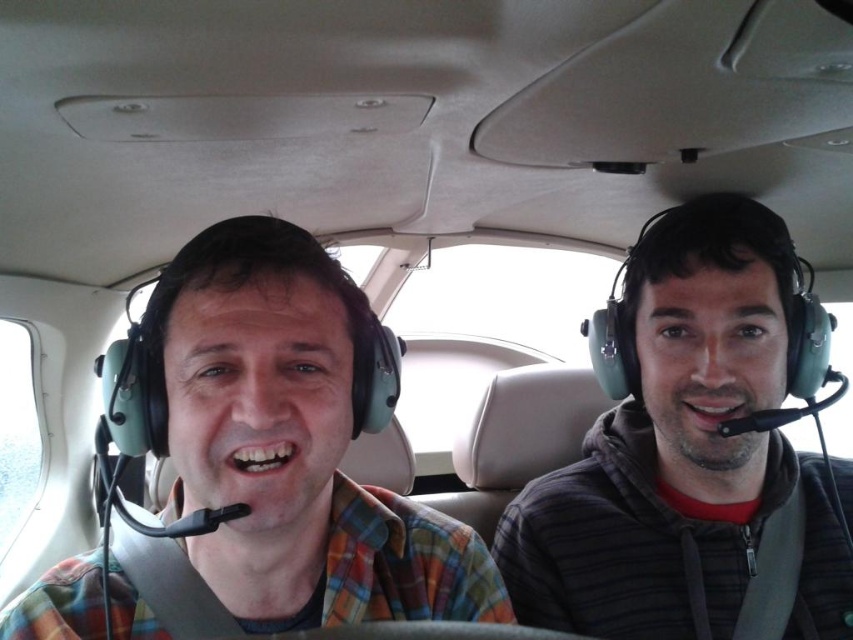
You are designing a storage compartment for cockpit accessories. The matte green headset at left and gray striped hoodie at right need to be stored. Based on their sizes, which object should be placed in the smaller compartment?

The matte green headset at left should be placed in the smaller compartment because it occupies less space than the gray striped hoodie at right.

You are a passenger in the aircraft and need to adjust the matte green headset at left and the gray striped hoodie at right. Which object is easier to reach without moving your seat?

The matte green headset at left is closer to the viewer than the gray striped hoodie at right, so it is easier to reach without moving your seat.

You are a passenger in the cockpit of a small aircraft and need to locate the matte green headset at left. Based on the coordinates provided, where should you look relative to the cockpit?

The matte green headset at left is located at the coordinates point (292, 444), which is on the left side of the cockpit near the pilot or co pilot seat.